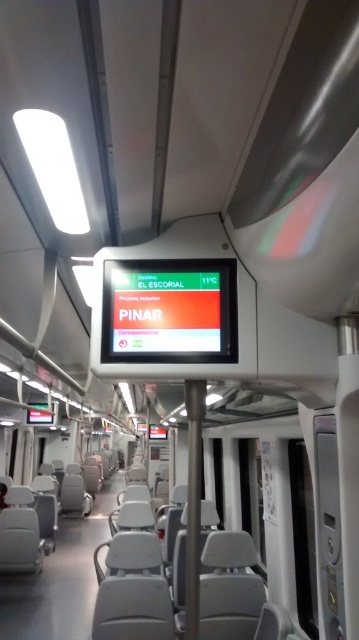
In the scene shown: You are a passenger standing in the train carriage and want to check the destination displayed on the matte orange display at center. However, there is a metallic pole at center blocking your view. Can you see the destination information clearly?

The matte orange display at center has a lesser height compared to metallic pole at center, so the pole is taller than the display. Since the pole is taller, it might block your view of the destination information on the display.

You are a passenger sitting in the train carriage and want to check the destination displayed on the matte orange display at center. Considering your seating position, can you comfortably read the display without moving your head too much?

The matte orange display at center is 6.36 feet away from you, which is a reasonable distance for comfortable reading without needing to move your head excessively.

You are a passenger sitting in the train carriage and want to check the destination and temperature displayed on the matte orange display at center. Where should you look to find this information?

The matte orange display at center is located at point (165, 310), so you should look at the center area of the ceiling where the coordinates indicate the display is mounted.